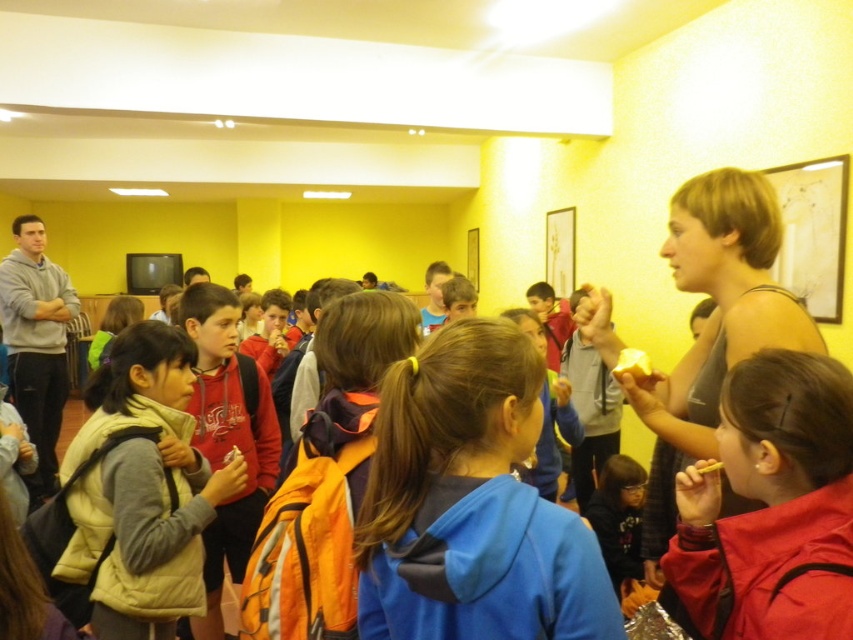
You are organizing a coat rack for a small group. The coat rack has a limited space between its hooks. You need to hang both the blue fleece jacket at center and the matte red jacket at lower right. Which jacket should you place first to ensure both fit properly?

The blue fleece jacket at center has a larger width than the matte red jacket at lower right. To ensure both fit properly on the coat rack, you should place the blue fleece jacket at center first, as it requires more space between the hooks.

You are standing in the room and want to hand a gift to the person wearing the matte red jacket at lower right. Which direction should you move to reach them, considering the blue fleece jacket at center is blocking your path?

The blue fleece jacket at center is positioned over matte red jacket at lower right, so you should move around the blue fleece jacket at center to reach the matte red jacket at lower right.

You are standing at the point marked as point (x=439, y=468). You want to throw a paper airplane to a friend who is standing 36.95 inches away from you. Is the distance within the typical throwing range for a paper airplane?

The distance between you and your friend is 36.95 inches, which is well within the typical throwing range for a paper airplane, so yes, you can throw it successfully.